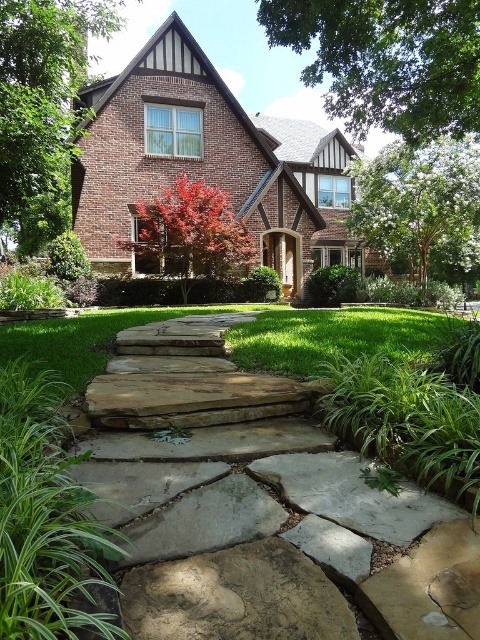
You are a delivery person holding a package that is 1.5 meters long. You need to walk along the pathway to deliver it to the house. Is there enough space between the brown rough stone at center and the camera to move the package without hitting anything?

The brown rough stone at center is 1.5 meters away from the camera, so the package can be moved safely as the distance is sufficient.